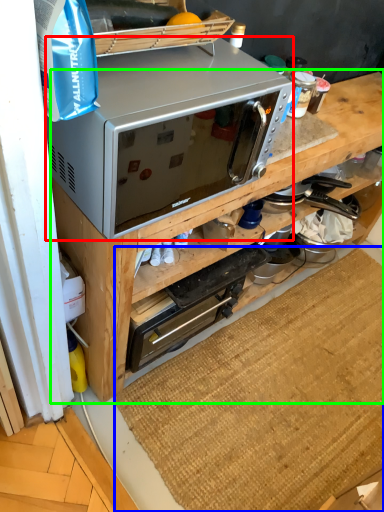
Question: Estimate the real-world distances between objects in this image. Which object is farther from microwave oven (highlighted by a red box), doormat (highlighted by a blue box) or cabinetry (highlighted by a green box)?

Choices:
 (A) doormat
 (B) cabinetry

Answer: (A)